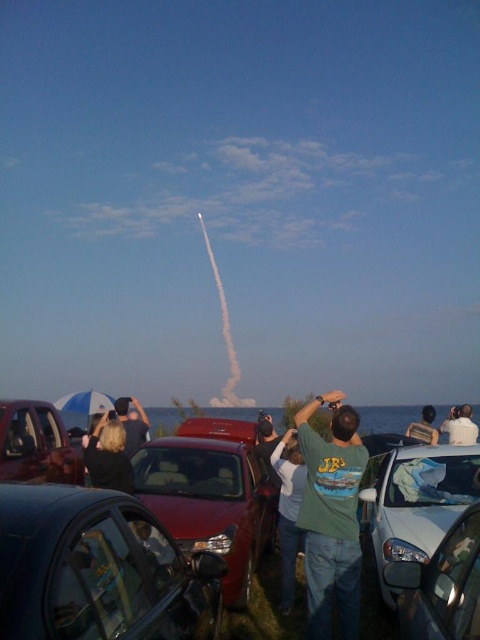
Question: Based on their relative distances, which object is farther from the metallic silver car at lower left?

Choices:
 (A) dark gray shirt at center
 (B) shiny red car at center

Answer: (B)

Question: Considering the real-world distances, which object is closest to the shiny red car at center?

Choices:
 (A) white glossy car at lower right
 (B) dark hair at center
 (C) green t-shirt at center

Answer: (B)

Question: Does metallic silver car at lower left have a lesser width compared to dark gray shirt at center?

Choices:
 (A) yes
 (B) no

Answer: (A)

Question: Is shiny red car at center behind metallic silver car at lower left?

Choices:
 (A) no
 (B) yes

Answer: (A)

Question: Is metallic silver car at lower right closer to camera compared to metallic silver car at lower left?

Choices:
 (A) yes
 (B) no

Answer: (A)

Question: Which object is farther from the camera taking this photo?

Choices:
 (A) shiny black car at lower left
 (B) dark hair at center
 (C) shiny red car at center

Answer: (B)